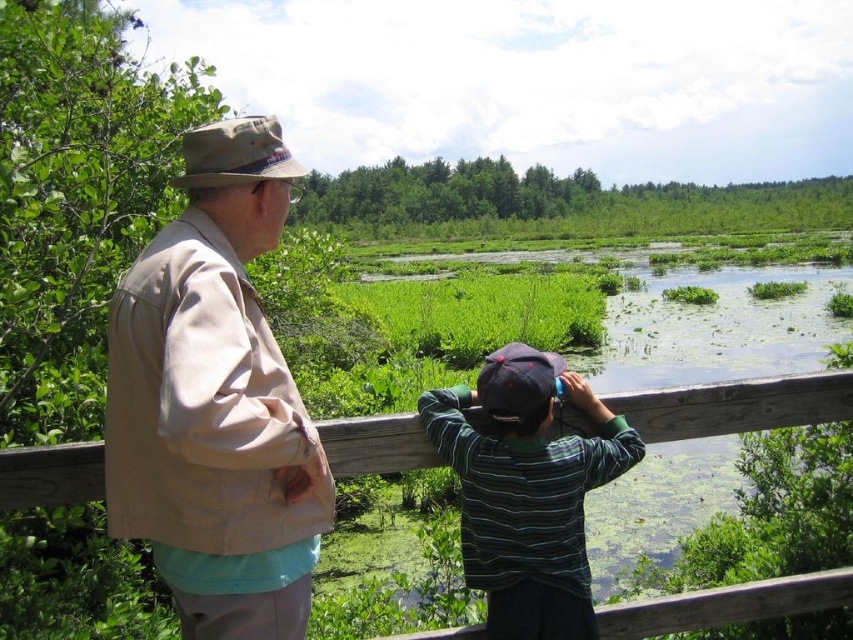
Does green striped shirt at center have a smaller size compared to wooden fence at center?

No.

Who is more forward, (463, 513) or (747, 412)?

Point (463, 513) is more forward.

Describe the element at coordinates (527, 490) in the screenshot. Image resolution: width=853 pixels, height=640 pixels. I see `green striped shirt at center` at that location.

Image resolution: width=853 pixels, height=640 pixels. What are the coordinates of `green striped shirt at center` in the screenshot? It's located at (527, 490).

Is khaki fabric jacket at upper left wider than green striped shirt at center?

No.

What do you see at coordinates (215, 401) in the screenshot?
I see `khaki fabric jacket at upper left` at bounding box center [215, 401].

Between point (259, 600) and point (531, 582), which one is positioned in front?

Point (259, 600) is in front.

This screenshot has width=853, height=640. Identify the location of khaki fabric jacket at upper left. (215, 401).

Which of these two, khaki fabric jacket at upper left or wooden fence at center, stands shorter?

Standing shorter between the two is wooden fence at center.

Image resolution: width=853 pixels, height=640 pixels. I want to click on khaki fabric jacket at upper left, so click(x=215, y=401).

You are a GUI agent. You are given a task and a screenshot of the screen. Output one action in this format:
    pyautogui.click(x=<x>, y=<y>)
    Task: Click on the khaki fabric jacket at upper left
    
    Given the screenshot: What is the action you would take?
    pyautogui.click(x=215, y=401)